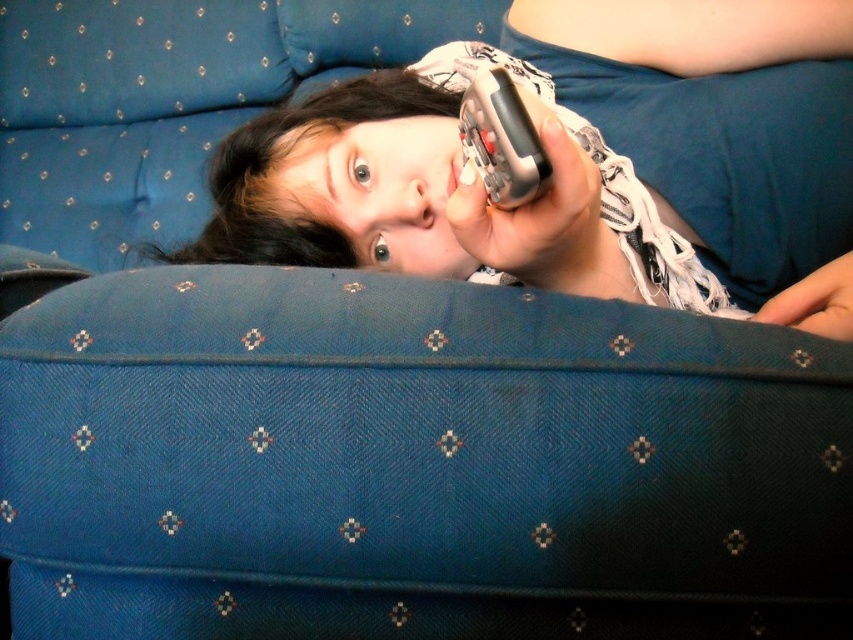
Which is more to the left, matte plastic remote at center or metallic silver phone at upper center?

metallic silver phone at upper center is more to the left.

Can you confirm if matte plastic remote at center is taller than metallic silver phone at upper center?

Yes.

Measure the distance between point (485, 195) and camera.

The distance of point (485, 195) from camera is 17.07 inches.

Image resolution: width=853 pixels, height=640 pixels. In order to click on matte plastic remote at center in this screenshot , I will do `click(578, 163)`.